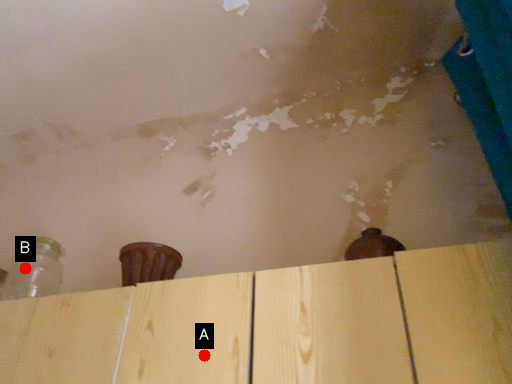
Question: Two points are circled on the image, labeled by A and B beside each circle. Which point is farther from the camera taking this photo?

Choices:
 (A) A is further
 (B) B is further

Answer: (B)